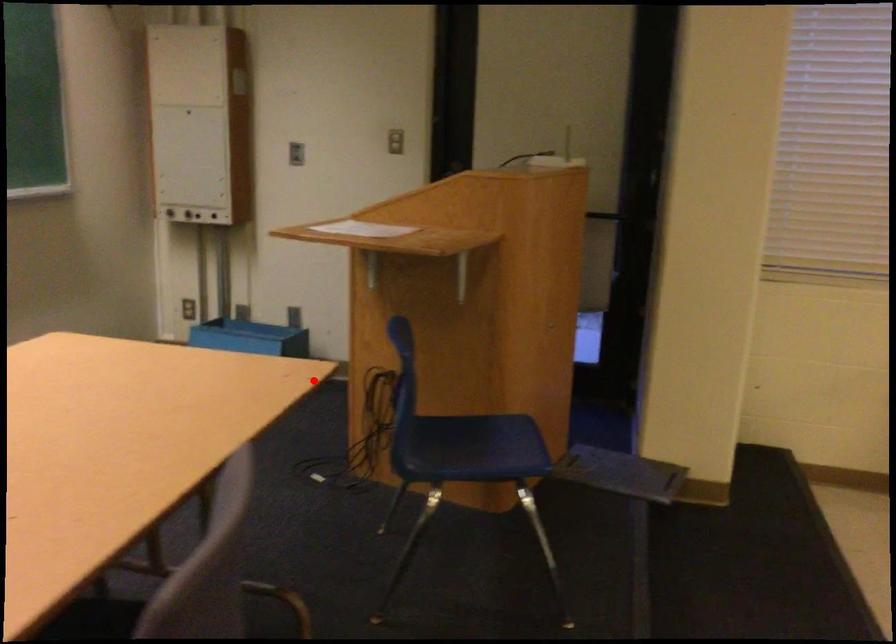
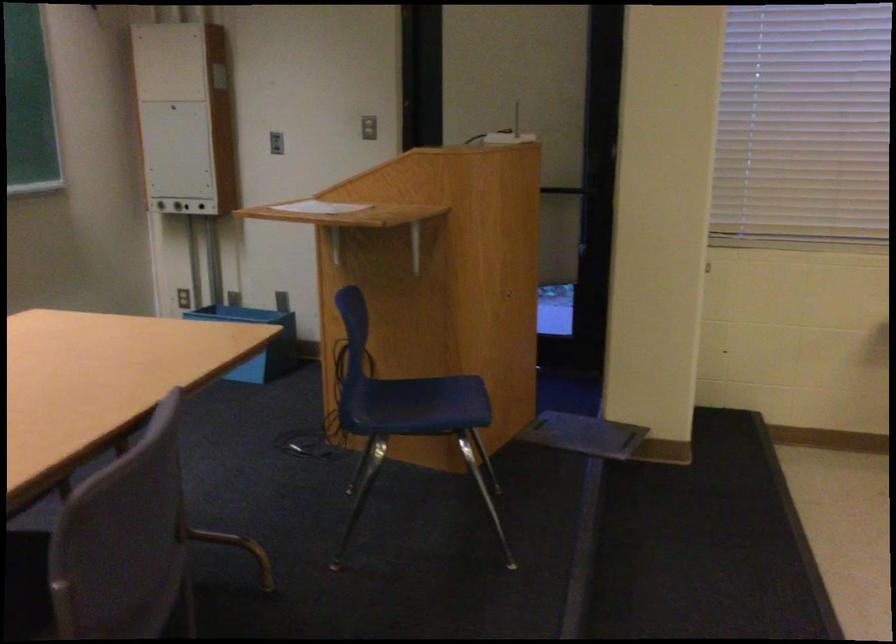
Where in the second image is the point corresponding to the highlighted location from the first image?

(256, 341)